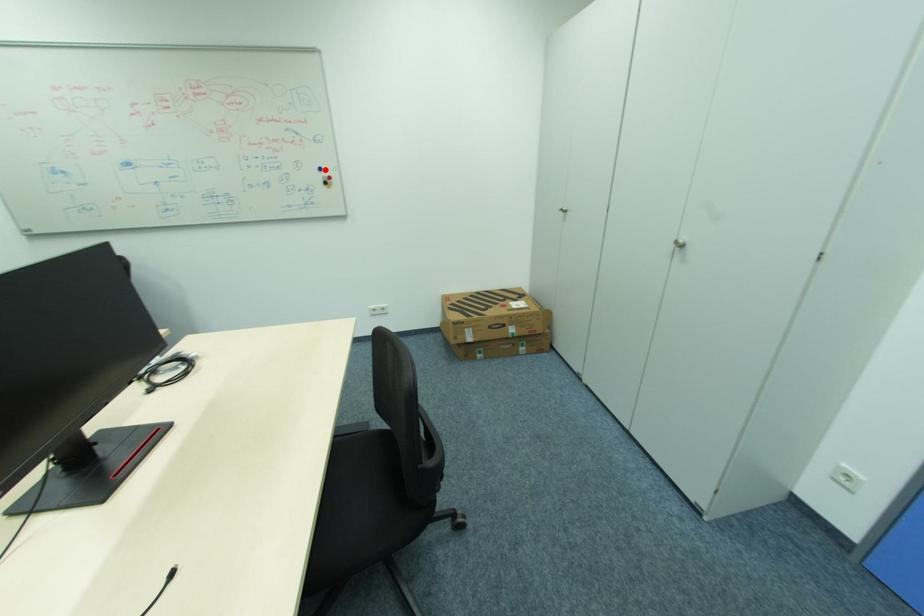
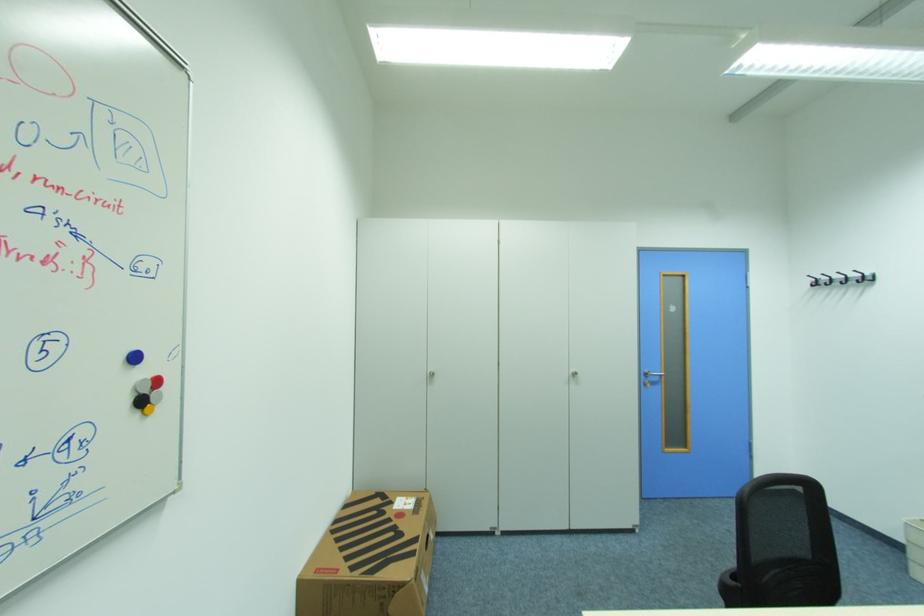
Find the pixel in the second image that matches the highlighted location in the first image.

(140, 359)